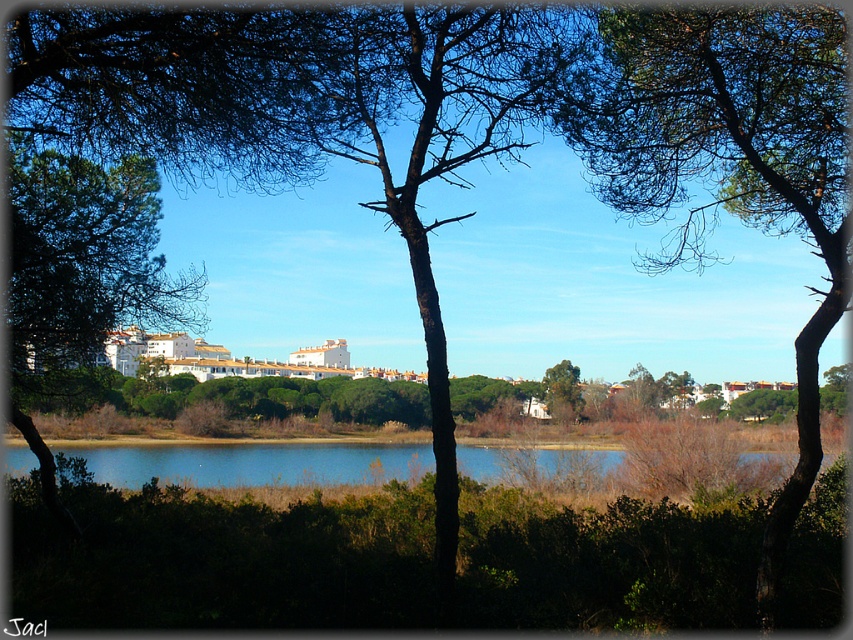
Is brown textured tree at center behind green matte tree at center?

No.

What do you see at coordinates (306, 112) in the screenshot? Image resolution: width=853 pixels, height=640 pixels. I see `brown textured tree at center` at bounding box center [306, 112].

Identify the location of brown textured tree at center. The width and height of the screenshot is (853, 640). (306, 112).

Where is `brown textured tree at center`? The image size is (853, 640). brown textured tree at center is located at coordinates (306, 112).

Which is behind, point (19, 156) or point (500, 472)?

Positioned behind is point (500, 472).

Can you confirm if green matte tree at left is positioned below blue water at center?

No.

Between point (102, 340) and point (344, 444), which one is positioned in front?

Point (102, 340) is more forward.

You are a GUI agent. You are given a task and a screenshot of the screen. Output one action in this format:
    pyautogui.click(x=<x>, y=<y>)
    Task: Click on the green matte tree at left
    The height and width of the screenshot is (640, 853).
    Given the screenshot: What is the action you would take?
    pyautogui.click(x=80, y=272)

Who is more distant from viewer, [700,36] or [16,426]?

The point [16,426] is more distant.

From the picture: Is green rough bark tree at center in front of green matte tree at left?

Yes, it is in front of green matte tree at left.

Locate an element on the screen. The image size is (853, 640). green rough bark tree at center is located at coordinates (726, 160).